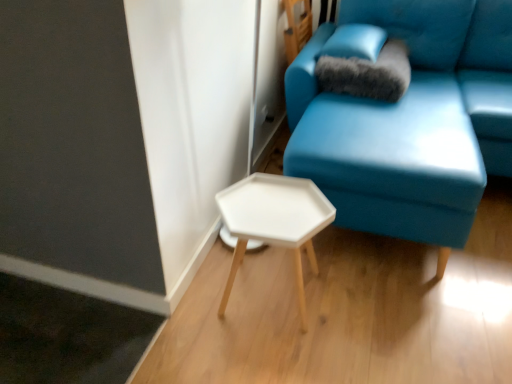
Question: From a real-world perspective, relative to white matte hexagonal table at center, is matte blue couch at center vertically above or below?

Choices:
 (A) above
 (B) below

Answer: (A)

Question: From the image's perspective, is matte blue couch at center above or below white matte hexagonal table at center?

Choices:
 (A) above
 (B) below

Answer: (A)

Question: Considering the real-world distances, which object is closest to the satin blue pillow at upper right, marked as the 1th pillow in a top-to-bottom arrangement?

Choices:
 (A) white matte hexagonal table at center
 (B) matte blue couch at center
 (C) fuzzy gray pillow at upper right, marked as the first pillow in a bottom-to-top arrangement

Answer: (C)

Question: Which object is the farthest from the fuzzy gray pillow at upper right, marked as the first pillow in a bottom-to-top arrangement?

Choices:
 (A) white matte hexagonal table at center
 (B) satin blue pillow at upper right, placed as the 2th pillow when sorted from bottom to top
 (C) matte blue couch at center

Answer: (A)